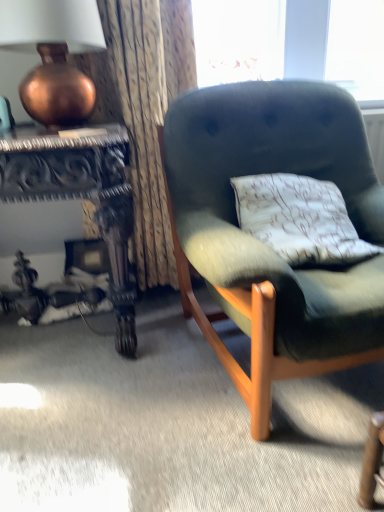
Question: Could you tell me if copper metallic vase at upper left is facing textured fabric curtain at upper left?

Choices:
 (A) no
 (B) yes

Answer: (B)

Question: Considering the relative sizes of copper metallic vase at upper left and textured fabric curtain at upper left in the image provided, is copper metallic vase at upper left shorter than textured fabric curtain at upper left?

Choices:
 (A) yes
 (B) no

Answer: (A)

Question: Would you say copper metallic vase at upper left contains textured fabric curtain at upper left?

Choices:
 (A) yes
 (B) no

Answer: (B)

Question: Does copper metallic vase at upper left have a larger size compared to textured fabric curtain at upper left?

Choices:
 (A) yes
 (B) no

Answer: (B)

Question: Is copper metallic vase at upper left at the right side of textured fabric curtain at upper left?

Choices:
 (A) yes
 (B) no

Answer: (B)

Question: Considering the relative sizes of copper metallic vase at upper left and textured fabric curtain at upper left in the image provided, is copper metallic vase at upper left taller than textured fabric curtain at upper left?

Choices:
 (A) yes
 (B) no

Answer: (B)

Question: Would you say velvet green armchair at center is a long distance from textured fabric curtain at upper left?

Choices:
 (A) no
 (B) yes

Answer: (A)

Question: Is the depth of velvet green armchair at center greater than that of textured fabric curtain at upper left?

Choices:
 (A) yes
 (B) no

Answer: (B)

Question: Does velvet green armchair at center appear on the left side of textured fabric curtain at upper left?

Choices:
 (A) no
 (B) yes

Answer: (A)

Question: Does velvet green armchair at center have a greater height compared to textured fabric curtain at upper left?

Choices:
 (A) no
 (B) yes

Answer: (A)

Question: From the image's perspective, is velvet green armchair at center beneath textured fabric curtain at upper left?

Choices:
 (A) no
 (B) yes

Answer: (B)

Question: Can you confirm if velvet green armchair at center is smaller than textured fabric curtain at upper left?

Choices:
 (A) no
 (B) yes

Answer: (A)

Question: From the image's perspective, does textured fabric curtain at upper left appear lower than velvet green armchair at center?

Choices:
 (A) no
 (B) yes

Answer: (A)